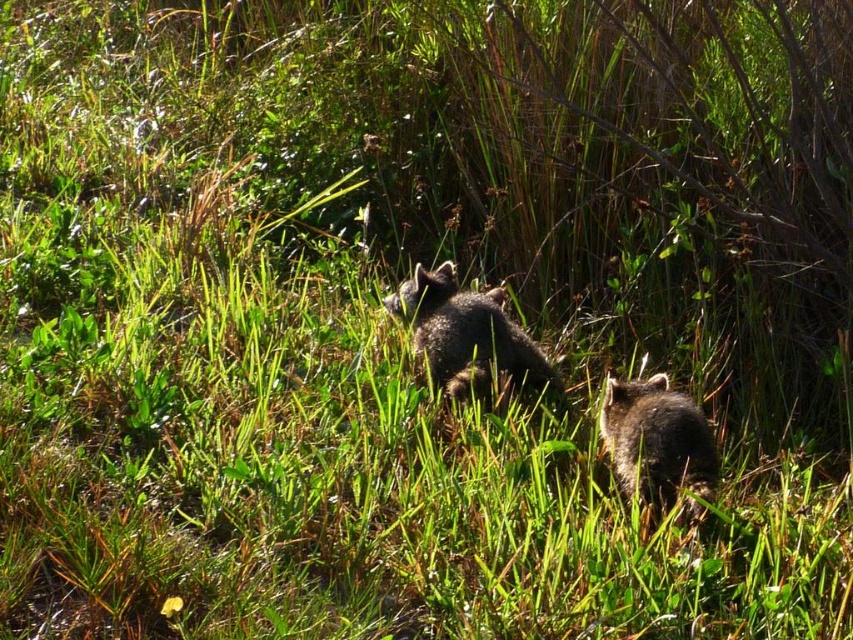
You are a photographer trying to capture both the fuzzy brown fox at center and the fuzzy brown raccoon at lower right in a single shot. Based on their positions, which animal should you adjust your camera to focus on first to ensure both are in frame?

The fuzzy brown fox at center is to the left of the fuzzy brown raccoon at lower right, so you should focus on the fuzzy brown raccoon at lower right first to ensure both are in frame.

You are a photographer trying to capture a closeup of the fuzzy brown fox at center. You are currently standing at point A located at coordinates (467, 336). Is this point a good location to get a clear view of the fuzzy brown fox at center?

Yes, because the point (467, 336) is on the fuzzy brown fox at center, so you are already positioned directly on the fox, allowing for a clear closeup shot.

You are a hiker who wants to take a photo of the fuzzy brown fox at center and the fuzzy brown raccoon at lower right without stepping on any plants. Which animal should you move closer to first to avoid trampling the grass?

The fuzzy brown raccoon at lower right is located lower right, so you should move closer to the fuzzy brown raccoon at lower right first to avoid trampling the grass since it is positioned lower and closer to the ground.